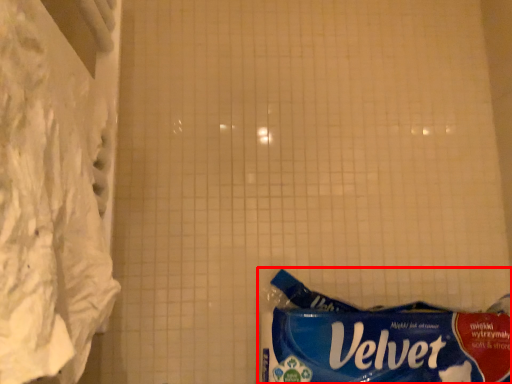
Question: From the image's perspective, what is the correct spatial relationship of waste (annotated by the red box) in relation to curtain?

Choices:
 (A) above
 (B) below

Answer: (B)